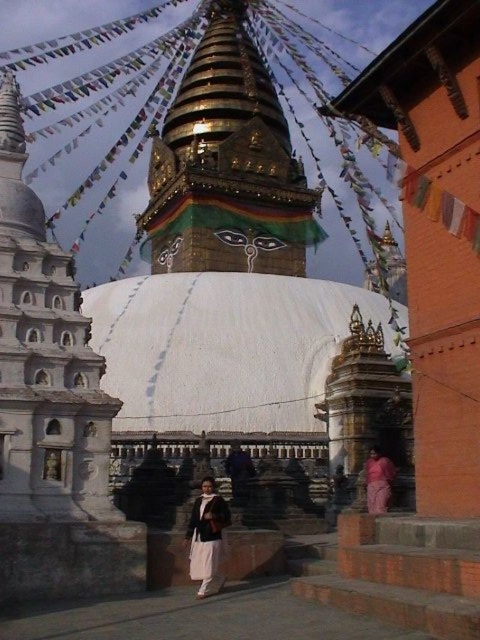
You are a photographer standing in front of the Buddhist stupa. You notice a white cotton robe at center and a pink fabric at lower right. Which object is positioned to the left when viewed from your perspective?

The white cotton robe at center is to the left of the pink fabric at lower right.

You are a photographer planning to capture the central stupa in the image. You notice a white cotton robe at center and a pink fabric at lower right in the foreground. To ensure both items are in frame without overlapping, which fabric should you position closer to the camera?

The white cotton robe at center is wider than the pink fabric at lower right, so positioning the white cotton robe at center closer to the camera will help prevent overlap while maintaining visibility of both items.